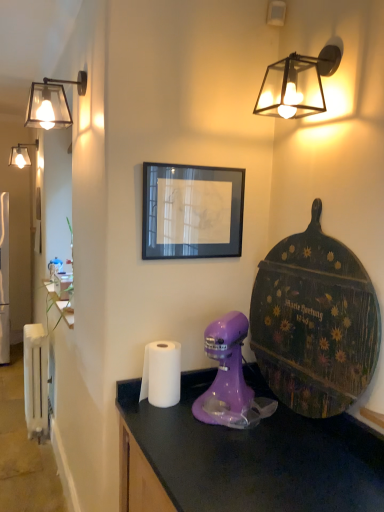
Describe the element at coordinates (297, 84) in the screenshot. This screenshot has width=384, height=512. I see `matte black glass lamp at upper right, positioned as the third lamp in left-to-right order` at that location.

This screenshot has height=512, width=384. Identify the location of matte black glass lamp at upper right, marked as the 1th lamp in a right-to-left arrangement. (297, 84).

Where is `black glass picture frame at center`? black glass picture frame at center is located at coordinates tap(192, 211).

Based on the photo, in order to face black glass picture frame at center, should I rotate leftwards or rightwards?

Turn right approximately 0.432 degrees to face it.

Locate an element on the screen. Image resolution: width=384 pixels, height=512 pixels. matte purple mixer at center is located at coordinates (230, 379).

Is matte glass lampshade at upper left, positioned as the second lamp in front-to-back order, oriented towards black glass picture frame at center?

No, matte glass lampshade at upper left, positioned as the second lamp in front-to-back order, does not turn towards black glass picture frame at center.

Is point (70, 118) positioned before point (176, 195)?

No, (70, 118) is behind (176, 195).

Can we say matte glass lampshade at upper left, placed as the second lamp when sorted from left to right, lies outside black glass picture frame at center?

matte glass lampshade at upper left, placed as the second lamp when sorted from left to right, lies outside black glass picture frame at center's area.

Can you confirm if matte glass lampshade at upper left, the second lamp from the back, is smaller than black glass picture frame at center?

Actually, matte glass lampshade at upper left, the second lamp from the back, might be larger than black glass picture frame at center.

Is black glass picture frame at center touching matte glass lampshade at upper left, the second lamp from the back?

No, black glass picture frame at center is not with matte glass lampshade at upper left, the second lamp from the back.

Could matte glass lampshade at upper left, the second lamp from the back, be considered to be inside black glass picture frame at center?

Result: Actually, matte glass lampshade at upper left, the second lamp from the back, is outside black glass picture frame at center.

Is black glass picture frame at center positioned with its back to matte glass lampshade at upper left, arranged as the second lamp when viewed from the right?

That's not correct — black glass picture frame at center is not looking away from matte glass lampshade at upper left, arranged as the second lamp when viewed from the right.

From the image's perspective, is black glass picture frame at center over matte glass lampshade at upper left, positioned as the second lamp in front-to-back order?

No.

From the image's perspective, is matte glass lamp at upper left, the 3th lamp viewed from the right, on black glass picture frame at center?

Indeed, from the image's perspective, matte glass lamp at upper left, the 3th lamp viewed from the right, is shown above black glass picture frame at center.

Is matte glass lamp at upper left, the 3th lamp viewed from the right, facing towards black glass picture frame at center?

No.

What are the coordinates of `the 2nd lamp behind when counting from the black glass picture frame at center` in the screenshot? It's located at (21, 154).

Considering the sizes of objects matte glass lamp at upper left, positioned as the first lamp in back-to-front order, and black glass picture frame at center in the image provided, who is smaller, matte glass lamp at upper left, positioned as the first lamp in back-to-front order, or black glass picture frame at center?

black glass picture frame at center is smaller.

Is matte glass lamp at upper left, the 3th lamp viewed from the right, oriented towards matte glass lampshade at upper left, positioned as the second lamp in front-to-back order?

No, matte glass lamp at upper left, the 3th lamp viewed from the right, does not turn towards matte glass lampshade at upper left, positioned as the second lamp in front-to-back order.

Relative to matte glass lampshade at upper left, arranged as the second lamp when viewed from the right, is matte glass lamp at upper left, which ranks as the third lamp in front-to-back order, in front or behind?

Visually, matte glass lamp at upper left, which ranks as the third lamp in front-to-back order, is located behind matte glass lampshade at upper left, arranged as the second lamp when viewed from the right.

Is matte glass lamp at upper left, placed as the 1th lamp when sorted from left to right, beside matte glass lampshade at upper left, the second lamp from the back?

They are not placed beside each other.

Does white metallic radiator at left lie behind white paper towel at center?

Yes, the depth of white metallic radiator at left is greater than that of white paper towel at center.

From the picture: Which object is wider, white metallic radiator at left or white paper towel at center?

white paper towel at center is wider.

Considering the positions of objects white metallic radiator at left and white paper towel at center in the image provided, who is more to the left, white metallic radiator at left or white paper towel at center?

Positioned to the left is white metallic radiator at left.

Is matte glass lampshade at upper left, the second lamp from the back, surrounding matte black glass lamp at upper right, marked as the 1th lamp in a right-to-left arrangement?

No, matte black glass lamp at upper right, marked as the 1th lamp in a right-to-left arrangement, is located outside of matte glass lampshade at upper left, the second lamp from the back.

Is matte glass lampshade at upper left, placed as the second lamp when sorted from left to right, placed right next to matte black glass lamp at upper right, marked as the 1th lamp in a right-to-left arrangement?

matte glass lampshade at upper left, placed as the second lamp when sorted from left to right, and matte black glass lamp at upper right, marked as the 1th lamp in a right-to-left arrangement, are not in contact.

Who is taller, matte glass lampshade at upper left, arranged as the second lamp when viewed from the right, or matte black glass lamp at upper right, positioned as the third lamp in left-to-right order?

Standing taller between the two is matte glass lampshade at upper left, arranged as the second lamp when viewed from the right.

This screenshot has width=384, height=512. What are the coordinates of `lamp that is on the right side of matte glass lampshade at upper left, positioned as the second lamp in front-to-back order` in the screenshot? It's located at (297, 84).

Is white metallic radiator at left in front of or behind matte glass lamp at upper left, the 3th lamp viewed from the right, in the image?

In the image, white metallic radiator at left appears in front of matte glass lamp at upper left, the 3th lamp viewed from the right.

From their relative heights in the image, would you say white metallic radiator at left is taller or shorter than matte glass lamp at upper left, positioned as the first lamp in back-to-front order?

white metallic radiator at left is taller than matte glass lamp at upper left, positioned as the first lamp in back-to-front order.

Considering the relative sizes of white metallic radiator at left and matte glass lamp at upper left, placed as the 1th lamp when sorted from left to right, in the image provided, is white metallic radiator at left smaller than matte glass lamp at upper left, placed as the 1th lamp when sorted from left to right,?

No, white metallic radiator at left is not smaller than matte glass lamp at upper left, placed as the 1th lamp when sorted from left to right.

Is white metallic radiator at left oriented away from matte glass lamp at upper left, placed as the 1th lamp when sorted from left to right?

That's not correct — white metallic radiator at left is not looking away from matte glass lamp at upper left, placed as the 1th lamp when sorted from left to right.

Locate an element on the screen. This screenshot has width=384, height=512. the 1st lamp behind when counting from the black glass picture frame at center is located at coordinates (52, 103).

You are a GUI agent. You are given a task and a screenshot of the screen. Output one action in this format:
    pyautogui.click(x=<x>, y=<y>)
    Task: Click on the picture frame that is in front of the matte glass lampshade at upper left, positioned as the second lamp in front-to-back order
    
    Given the screenshot: What is the action you would take?
    pyautogui.click(x=192, y=211)

Estimate the real-world distances between objects in this image. Which object is further from black glass picture frame at center, white metallic radiator at left or matte glass lamp at upper left, which ranks as the third lamp in front-to-back order?

The object further to black glass picture frame at center is matte glass lamp at upper left, which ranks as the third lamp in front-to-back order.

Looking at the image, which one is located closer to matte glass lampshade at upper left, positioned as the second lamp in front-to-back order, matte glass lamp at upper left, placed as the 1th lamp when sorted from left to right, or matte black glass lamp at upper right, positioned as the third lamp in left-to-right order?

matte black glass lamp at upper right, positioned as the third lamp in left-to-right order, lies closer to matte glass lampshade at upper left, positioned as the second lamp in front-to-back order, than the other object.

When comparing their distances from matte glass lampshade at upper left, placed as the second lamp when sorted from left to right, does black glass picture frame at center or matte purple mixer at center seem further?

matte purple mixer at center is further to matte glass lampshade at upper left, placed as the second lamp when sorted from left to right.

Estimate the real-world distances between objects in this image. Which object is further from white metallic radiator at left, matte glass lamp at upper left, positioned as the first lamp in back-to-front order, or matte purple mixer at center?

matte glass lamp at upper left, positioned as the first lamp in back-to-front order, is further to white metallic radiator at left.

Estimate the real-world distances between objects in this image. Which object is closer to matte glass lampshade at upper left, arranged as the second lamp when viewed from the right, white metallic radiator at left or matte black glass lamp at upper right, which is the 1th lamp in front-to-back order?

The object closer to matte glass lampshade at upper left, arranged as the second lamp when viewed from the right, is matte black glass lamp at upper right, which is the 1th lamp in front-to-back order.

From the image, which object appears to be farther from white metallic radiator at left, matte black glass lamp at upper right, positioned as the third lamp in left-to-right order, or matte glass lampshade at upper left, the second lamp from the back?

Based on the image, matte black glass lamp at upper right, positioned as the third lamp in left-to-right order, appears to be further to white metallic radiator at left.

When comparing their distances from matte black glass lamp at upper right, which appears as the third lamp when viewed from the back, does matte purple mixer at center or white paper towel at center seem closer?

Based on the image, matte purple mixer at center appears to be nearer to matte black glass lamp at upper right, which appears as the third lamp when viewed from the back.

Which object lies nearer to the anchor point white paper towel at center, matte black glass lamp at upper right, positioned as the third lamp in left-to-right order, or white metallic radiator at left?

Based on the image, matte black glass lamp at upper right, positioned as the third lamp in left-to-right order, appears to be nearer to white paper towel at center.

Locate an element on the screen. Image resolution: width=384 pixels, height=512 pixels. picture frame between white paper towel at center and matte glass lamp at upper left, which ranks as the third lamp in front-to-back order, in the front-back direction is located at coordinates (192, 211).

Where is `lamp between matte glass lampshade at upper left, the second lamp from the back, and matte purple mixer at center vertically`? lamp between matte glass lampshade at upper left, the second lamp from the back, and matte purple mixer at center vertically is located at coordinates (297, 84).

This screenshot has height=512, width=384. Find the location of `picture frame that lies between matte glass lampshade at upper left, the second lamp from the back, and matte purple mixer at center from top to bottom`. picture frame that lies between matte glass lampshade at upper left, the second lamp from the back, and matte purple mixer at center from top to bottom is located at coordinates (192, 211).

Where is `radiator located between white paper towel at center and matte glass lamp at upper left, placed as the 1th lamp when sorted from left to right, in the depth direction`? This screenshot has height=512, width=384. radiator located between white paper towel at center and matte glass lamp at upper left, placed as the 1th lamp when sorted from left to right, in the depth direction is located at coordinates (36, 379).